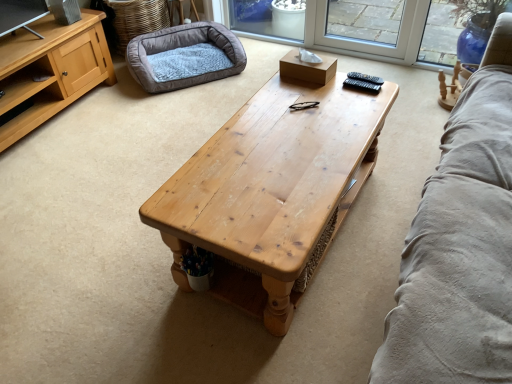
You are a GUI agent. You are given a task and a screenshot of the screen. Output one action in this format:
    pyautogui.click(x=<x>, y=<y>)
    Task: Click on the free point above wooden coffee table at center (from a real-world perspective)
    Image resolution: width=512 pixels, height=384 pixels.
    Given the screenshot: What is the action you would take?
    pyautogui.click(x=287, y=139)